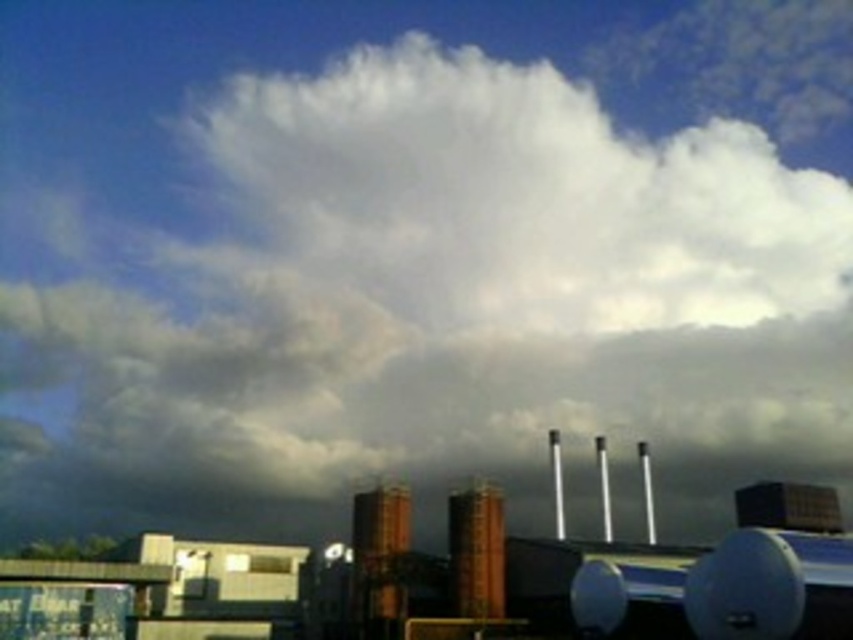
Question: Is metallic gray factory at center positioned in front of orange brick chimney at center?

Choices:
 (A) no
 (B) yes

Answer: (B)

Question: Is brown brick chimney at center in front of orange brick chimney at center?

Choices:
 (A) no
 (B) yes

Answer: (B)

Question: Among these objects, which one is nearest to the camera?

Choices:
 (A) orange brick chimney at center
 (B) brown brick chimney at center
 (C) metallic gray factory at center

Answer: (C)

Question: Estimate the real-world distances between objects in this image. Which object is closer to the orange brick chimney at center?

Choices:
 (A) metallic gray factory at center
 (B) brown brick chimney at center

Answer: (B)

Question: Can you confirm if metallic gray factory at center is wider than brown brick chimney at center?

Choices:
 (A) yes
 (B) no

Answer: (A)

Question: Considering the real-world distances, which object is farthest from the brown brick chimney at center?

Choices:
 (A) metallic gray factory at center
 (B) orange brick chimney at center

Answer: (A)